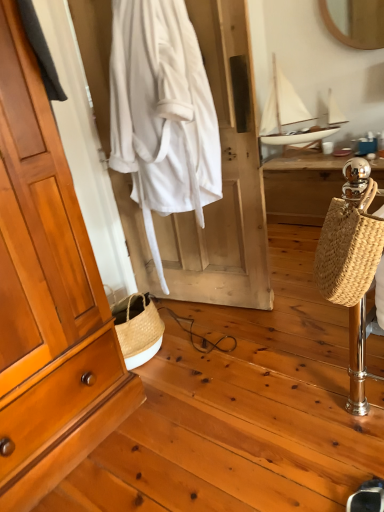
Question: Is black suede shoe at lower right to the left of woven straw bag at right from the viewer's perspective?

Choices:
 (A) yes
 (B) no

Answer: (B)

Question: Does black suede shoe at lower right lie in front of woven straw bag at right?

Choices:
 (A) yes
 (B) no

Answer: (B)

Question: From the image's perspective, is black suede shoe at lower right above woven straw bag at right?

Choices:
 (A) no
 (B) yes

Answer: (A)

Question: Is black suede shoe at lower right oriented away from woven straw bag at right?

Choices:
 (A) yes
 (B) no

Answer: (B)

Question: Does black suede shoe at lower right have a greater height compared to woven straw bag at right?

Choices:
 (A) no
 (B) yes

Answer: (A)

Question: Can you confirm if black suede shoe at lower right is thinner than woven straw bag at right?

Choices:
 (A) yes
 (B) no

Answer: (A)

Question: Is white cotton robe at center facing away from white matte sailboat at upper right?

Choices:
 (A) no
 (B) yes

Answer: (B)

Question: Considering the relative sizes of white cotton robe at center and white matte sailboat at upper right in the image provided, is white cotton robe at center thinner than white matte sailboat at upper right?

Choices:
 (A) no
 (B) yes

Answer: (B)

Question: From a real-world perspective, is white cotton robe at center positioned over white matte sailboat at upper right based on gravity?

Choices:
 (A) yes
 (B) no

Answer: (A)

Question: Is white cotton robe at center further to camera compared to white matte sailboat at upper right?

Choices:
 (A) no
 (B) yes

Answer: (A)

Question: Is white cotton robe at center surrounding white matte sailboat at upper right?

Choices:
 (A) no
 (B) yes

Answer: (A)

Question: Considering the relative sizes of white cotton robe at center and white matte sailboat at upper right in the image provided, is white cotton robe at center wider than white matte sailboat at upper right?

Choices:
 (A) no
 (B) yes

Answer: (A)

Question: Can you confirm if woven wood desk at right is positioned to the right of black suede shoe at lower right?

Choices:
 (A) yes
 (B) no

Answer: (A)